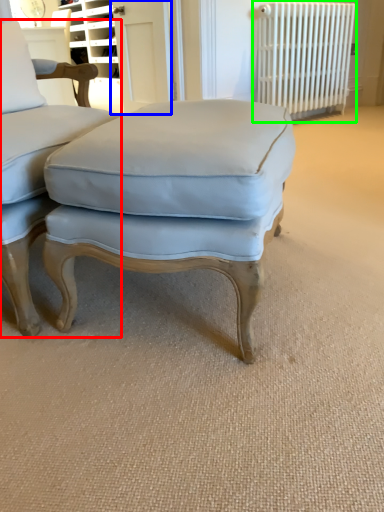
Question: Which is nearer to the chair (highlighted by a red box)? screen door (highlighted by a blue box) or radiator (highlighted by a green box).

Choices:
 (A) screen door
 (B) radiator

Answer: (A)